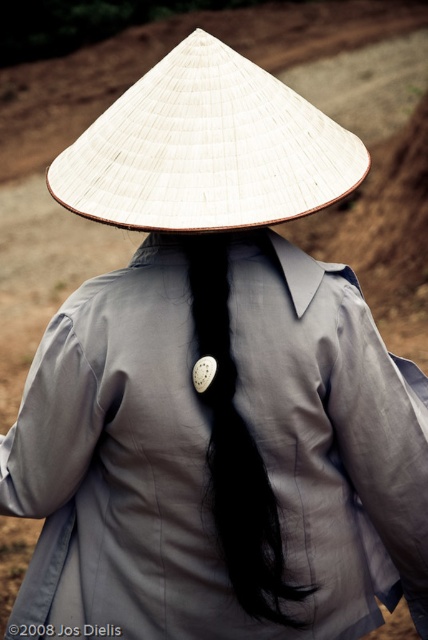
You are an observer standing behind the person in the image. You notice the white woven straw hat at center and the black matte hair at center. Which object appears bigger in size?

The white woven straw hat at center has a larger size compared to the black matte hair at center, so the white woven straw hat at center appears bigger in size.

You are standing in front of the person wearing the traditional conical hat and looking at their back. There are two points marked on their clothing and hat. The first point is at coordinate point (246, 164) and the second point is at coordinate point (234, 536). Which of these two points is closer to you?

Point (246, 164) is closer to the camera than point (234, 536).